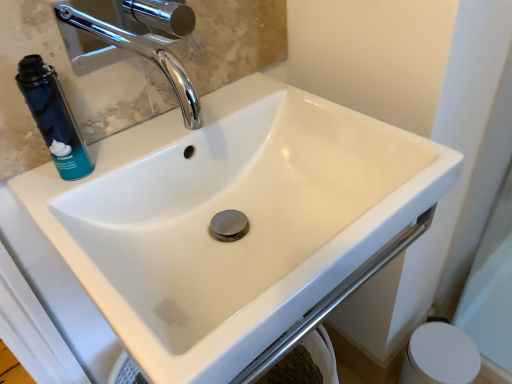
This screenshot has height=384, width=512. What do you see at coordinates (440, 356) in the screenshot?
I see `white matte toilet paper at lower right` at bounding box center [440, 356].

The height and width of the screenshot is (384, 512). Describe the element at coordinates (67, 88) in the screenshot. I see `matte glass mirror at upper left` at that location.

At what (x,y) coordinates should I click in order to perform the action: click on white matte toilet paper at lower right. Please return your answer as a coordinate pair (x, y). Looking at the image, I should click on 440,356.

Does point (417, 341) lie behind point (77, 141)?

Yes.

Looking at this image, are white matte toilet paper at lower right and blue matte can at upper left beside each other?

No, white matte toilet paper at lower right is not next to blue matte can at upper left.

Consider the image. Which is behind, white matte toilet paper at lower right or blue matte can at upper left?

white matte toilet paper at lower right.

Can you confirm if white matte toilet paper at lower right is wider than blue matte can at upper left?

Yes, white matte toilet paper at lower right is wider than blue matte can at upper left.

Based on the photo, measure the distance between matte glass mirror at upper left and white matte toilet paper at lower right.

matte glass mirror at upper left and white matte toilet paper at lower right are 88.40 centimeters apart from each other.

Which is behind, point (31, 146) or point (453, 365)?

Positioned behind is point (453, 365).

Is matte glass mirror at upper left not inside white matte toilet paper at lower right?

Indeed, matte glass mirror at upper left is completely outside white matte toilet paper at lower right.

From a real-world perspective, is blue matte can at upper left physically above white matte toilet paper at lower right?

Indeed, from a real-world perspective, blue matte can at upper left stands above white matte toilet paper at lower right.

Who is taller, blue matte can at upper left or white matte toilet paper at lower right?

Standing taller between the two is white matte toilet paper at lower right.

Is blue matte can at upper left facing away from white matte toilet paper at lower right?

blue matte can at upper left does not have its back to white matte toilet paper at lower right.

Who is bigger, blue matte can at upper left or white matte toilet paper at lower right?

Bigger between the two is white matte toilet paper at lower right.

In the scene shown: In terms of height, does blue matte can at upper left look taller or shorter compared to matte glass mirror at upper left?

Clearly, blue matte can at upper left is shorter compared to matte glass mirror at upper left.

What's the angular difference between blue matte can at upper left and matte glass mirror at upper left's facing directions?

0.931 degrees separate the facing orientations of blue matte can at upper left and matte glass mirror at upper left.

Considering the sizes of objects blue matte can at upper left and matte glass mirror at upper left in the image provided, who is thinner, blue matte can at upper left or matte glass mirror at upper left?

Thinner between the two is matte glass mirror at upper left.

From a real-world perspective, which object stands above the other?

matte glass mirror at upper left is physically above.

Considering the relative sizes of matte glass mirror at upper left and blue matte can at upper left in the image provided, is matte glass mirror at upper left shorter than blue matte can at upper left?

No.

Do you think matte glass mirror at upper left is within blue matte can at upper left, or outside of it?

The correct answer is: outside.

Which is more to the left, matte glass mirror at upper left or blue matte can at upper left?

blue matte can at upper left.

Is point (5, 141) closer or farther from the camera than point (22, 87)?

Point (5, 141).

From a real-world perspective, between white matte toilet paper at lower right and matte glass mirror at upper left, who is vertically higher?

matte glass mirror at upper left.

In terms of height, does white matte toilet paper at lower right look taller or shorter compared to matte glass mirror at upper left?

Clearly, white matte toilet paper at lower right is taller compared to matte glass mirror at upper left.

Could you tell me if white matte toilet paper at lower right is turned towards matte glass mirror at upper left?

No, white matte toilet paper at lower right is not turned towards matte glass mirror at upper left.

From the image's perspective, is white matte toilet paper at lower right under matte glass mirror at upper left?

Yes, from the image's perspective, white matte toilet paper at lower right is beneath matte glass mirror at upper left.

Where is `mouthwash located above the white matte toilet paper at lower right (from a real-world perspective)`? The height and width of the screenshot is (384, 512). mouthwash located above the white matte toilet paper at lower right (from a real-world perspective) is located at coordinates (53, 117).

The width and height of the screenshot is (512, 384). I want to click on mirror located above the white matte toilet paper at lower right (from the image's perspective), so click(x=67, y=88).

When comparing their distances from matte glass mirror at upper left, does white matte toilet paper at lower right or blue matte can at upper left seem closer?

blue matte can at upper left is closer to matte glass mirror at upper left.

From the image, which object appears to be farther from blue matte can at upper left, white matte toilet paper at lower right or matte glass mirror at upper left?

Based on the image, white matte toilet paper at lower right appears to be further to blue matte can at upper left.

When comparing their distances from white matte toilet paper at lower right, does matte glass mirror at upper left or blue matte can at upper left seem closer?

Among the two, matte glass mirror at upper left is located nearer to white matte toilet paper at lower right.

Estimate the real-world distances between objects in this image. Which object is further from matte glass mirror at upper left, blue matte can at upper left or white matte toilet paper at lower right?

The object further to matte glass mirror at upper left is white matte toilet paper at lower right.

Considering their positions, is matte glass mirror at upper left positioned further to blue matte can at upper left than white matte toilet paper at lower right?

white matte toilet paper at lower right is further to blue matte can at upper left.

Estimate the real-world distances between objects in this image. Which object is closer to white matte toilet paper at lower right, blue matte can at upper left or matte glass mirror at upper left?

Among the two, matte glass mirror at upper left is located nearer to white matte toilet paper at lower right.

This screenshot has height=384, width=512. What are the coordinates of `mirror between blue matte can at upper left and white matte toilet paper at lower right from left to right` in the screenshot? It's located at (67, 88).